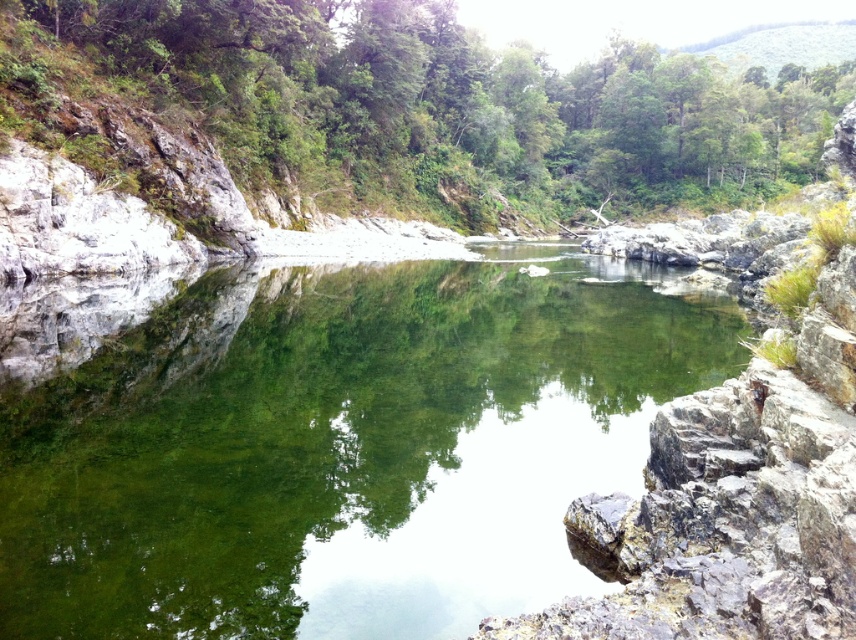
You are standing on the riverbank and want to take a photo of the clear glassy water at center and the green leafy tree at center. Which object should you focus on first if you want the tree to be in the background?

You should focus on the clear glassy water at center first because it is closer to you than the green leafy tree at center, so the tree will naturally be in the background.

You are standing at the edge of the river and want to cross to the other side. There is a point marked at coordinates point (343, 448). What is located at that point?

At point (343, 448) lies clear glassy water at center.